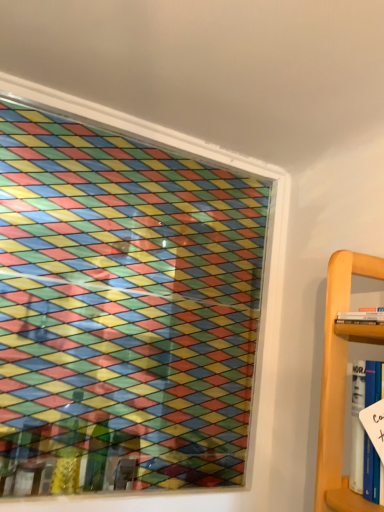
What do you see at coordinates (362, 316) in the screenshot? I see `white paperback book at right, the 2th book when ordered from bottom to top` at bounding box center [362, 316].

The width and height of the screenshot is (384, 512). I want to click on white paperback book at right, the 2th book when ordered from bottom to top, so [x=362, y=316].

The image size is (384, 512). In order to click on white paper at right, acting as the 2th book starting from the top in this screenshot , I will do `click(365, 431)`.

In order to face white paper at right, acting as the 2th book starting from the top, should I rotate leftwards or rightwards?

A 28.310 degree turn to the right will do.

What do you see at coordinates (365, 431) in the screenshot?
I see `white paper at right, acting as the 2th book starting from the top` at bounding box center [365, 431].

Identify the location of white paperback book at right, which ranks as the 1th book in top-to-bottom order. (362, 316).

Between white paperback book at right, which ranks as the 1th book in top-to-bottom order, and white paper at right, marked as the 1th book in a bottom-to-top arrangement, which one appears on the left side from the viewer's perspective?

white paper at right, marked as the 1th book in a bottom-to-top arrangement.

Relative to white paper at right, marked as the 1th book in a bottom-to-top arrangement, is white paperback book at right, which ranks as the 1th book in top-to-bottom order, in front or behind?

Clearly, white paperback book at right, which ranks as the 1th book in top-to-bottom order, is behind white paper at right, marked as the 1th book in a bottom-to-top arrangement.

Considering the points (368, 319) and (352, 382), which point is behind, point (368, 319) or point (352, 382)?

The point (352, 382) is farther from the camera.

From the image's perspective, is white paperback book at right, which ranks as the 1th book in top-to-bottom order, located above or below white paper at right, marked as the 1th book in a bottom-to-top arrangement?

From the image's perspective, white paperback book at right, which ranks as the 1th book in top-to-bottom order, appears above white paper at right, marked as the 1th book in a bottom-to-top arrangement.

From a real-world perspective, is white paperback book at right, which ranks as the 1th book in top-to-bottom order, located higher than white paper at right, acting as the 2th book starting from the top?

Yes, from a real-world perspective, white paperback book at right, which ranks as the 1th book in top-to-bottom order, is over white paper at right, acting as the 2th book starting from the top

Can you confirm if white paperback book at right, the 2th book when ordered from bottom to top, is wider than white paper at right, marked as the 1th book in a bottom-to-top arrangement?

Yes.

Considering the relative sizes of white paperback book at right, the 2th book when ordered from bottom to top, and white paper at right, acting as the 2th book starting from the top, in the image provided, is white paperback book at right, the 2th book when ordered from bottom to top, shorter than white paper at right, acting as the 2th book starting from the top,?

Yes.

Considering the sizes of objects white paperback book at right, which ranks as the 1th book in top-to-bottom order, and white paper at right, acting as the 2th book starting from the top, in the image provided, who is bigger, white paperback book at right, which ranks as the 1th book in top-to-bottom order, or white paper at right, acting as the 2th book starting from the top,?

white paper at right, acting as the 2th book starting from the top.

Would you say white paperback book at right, the 2th book when ordered from bottom to top, is outside white paper at right, acting as the 2th book starting from the top?

white paperback book at right, the 2th book when ordered from bottom to top, is positioned outside white paper at right, acting as the 2th book starting from the top.

Are white paperback book at right, the 2th book when ordered from bottom to top, and white paper at right, acting as the 2th book starting from the top, beside each other?

They are not placed beside each other.

Does white paperback book at right, the 2th book when ordered from bottom to top, turn towards white paper at right, acting as the 2th book starting from the top?

No, white paperback book at right, the 2th book when ordered from bottom to top, does not turn towards white paper at right, acting as the 2th book starting from the top.

Where is `book located on the left of white paperback book at right, which ranks as the 1th book in top-to-bottom order`? book located on the left of white paperback book at right, which ranks as the 1th book in top-to-bottom order is located at coordinates (365, 431).

Which is more to the left, white paper at right, marked as the 1th book in a bottom-to-top arrangement, or white paperback book at right, the 2th book when ordered from bottom to top?

From the viewer's perspective, white paper at right, marked as the 1th book in a bottom-to-top arrangement, appears more on the left side.

Is white paper at right, marked as the 1th book in a bottom-to-top arrangement, in front of or behind white paperback book at right, the 2th book when ordered from bottom to top, in the image?

Clearly, white paper at right, marked as the 1th book in a bottom-to-top arrangement, is in front of white paperback book at right, the 2th book when ordered from bottom to top.

Which is further, (365,396) or (374,315)?

Point (374,315)

From the image's perspective, which one is positioned higher, white paper at right, marked as the 1th book in a bottom-to-top arrangement, or white paperback book at right, which ranks as the 1th book in top-to-bottom order?

white paperback book at right, which ranks as the 1th book in top-to-bottom order, is shown above in the image.

From a real-world perspective, is white paper at right, acting as the 2th book starting from the top, physically above white paperback book at right, which ranks as the 1th book in top-to-bottom order?

No, from a real-world perspective, white paper at right, acting as the 2th book starting from the top, is not over white paperback book at right, which ranks as the 1th book in top-to-bottom order

Can you confirm if white paper at right, acting as the 2th book starting from the top, is thinner than white paperback book at right, the 2th book when ordered from bottom to top?

Yes.

Considering the sizes of white paper at right, marked as the 1th book in a bottom-to-top arrangement, and white paperback book at right, which ranks as the 1th book in top-to-bottom order, in the image, is white paper at right, marked as the 1th book in a bottom-to-top arrangement, taller or shorter than white paperback book at right, which ranks as the 1th book in top-to-bottom order,?

In the image, white paper at right, marked as the 1th book in a bottom-to-top arrangement, appears to be taller than white paperback book at right, which ranks as the 1th book in top-to-bottom order.

Which of these two, white paper at right, acting as the 2th book starting from the top, or white paperback book at right, which ranks as the 1th book in top-to-bottom order, is smaller?

white paperback book at right, which ranks as the 1th book in top-to-bottom order.

Is white paper at right, marked as the 1th book in a bottom-to-top arrangement, positioned beyond the bounds of white paperback book at right, the 2th book when ordered from bottom to top?

Yes, white paper at right, marked as the 1th book in a bottom-to-top arrangement, is located beyond the bounds of white paperback book at right, the 2th book when ordered from bottom to top.

Are white paper at right, acting as the 2th book starting from the top, and white paperback book at right, the 2th book when ordered from bottom to top, making contact?

No.

Could you tell me if white paper at right, acting as the 2th book starting from the top, is facing white paperback book at right, which ranks as the 1th book in top-to-bottom order?

No, white paper at right, acting as the 2th book starting from the top, does not turn towards white paperback book at right, which ranks as the 1th book in top-to-bottom order.

In the scene shown: What's the angular difference between white paper at right, marked as the 1th book in a bottom-to-top arrangement, and white paperback book at right, the 2th book when ordered from bottom to top,'s facing directions?

There is a 2.73-degree angle between the facing directions of white paper at right, marked as the 1th book in a bottom-to-top arrangement, and white paperback book at right, the 2th book when ordered from bottom to top.

Find the location of a particular element. book above the white paper at right, marked as the 1th book in a bottom-to-top arrangement (from a real-world perspective) is located at coordinates (362, 316).

I want to click on book in front of the white paperback book at right, which ranks as the 1th book in top-to-bottom order, so click(365, 431).

Where is `book located underneath the white paperback book at right, the 2th book when ordered from bottom to top (from a real-world perspective)`? book located underneath the white paperback book at right, the 2th book when ordered from bottom to top (from a real-world perspective) is located at coordinates (365, 431).